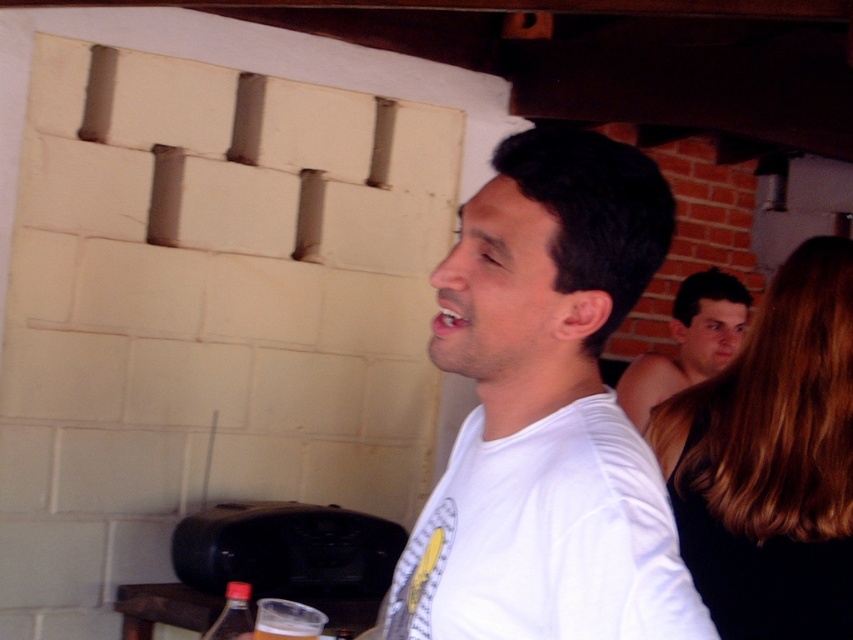
Identify the location of smooth black dress at right. This screenshot has height=640, width=853. [x=772, y=460].

Who is positioned more to the left, smooth black dress at right or smooth skin face at upper right?

From the viewer's perspective, smooth black dress at right appears more on the left side.

Who is more forward, (795, 561) or (698, 284)?

Point (795, 561) is in front.

Find the location of `smooth black dress at right`. smooth black dress at right is located at coordinates (772, 460).

The width and height of the screenshot is (853, 640). What do you see at coordinates (688, 342) in the screenshot?
I see `smooth skin face at upper right` at bounding box center [688, 342].

Between smooth skin face at upper right and translucent plastic cup at lower center, which one appears on the right side from the viewer's perspective?

From the viewer's perspective, smooth skin face at upper right appears more on the right side.

Between point (695, 372) and point (312, 632), which one is positioned in front?

Point (312, 632)

Identify the location of smooth skin face at upper right. (688, 342).

Which is in front, point (518, 536) or point (701, 353)?

Point (518, 536) is more forward.

This screenshot has width=853, height=640. I want to click on white matte shirt at center, so click(547, 412).

Does point (509, 289) come farther from viewer compared to point (679, 376)?

No, it is not.

The height and width of the screenshot is (640, 853). I want to click on white matte shirt at center, so click(547, 412).